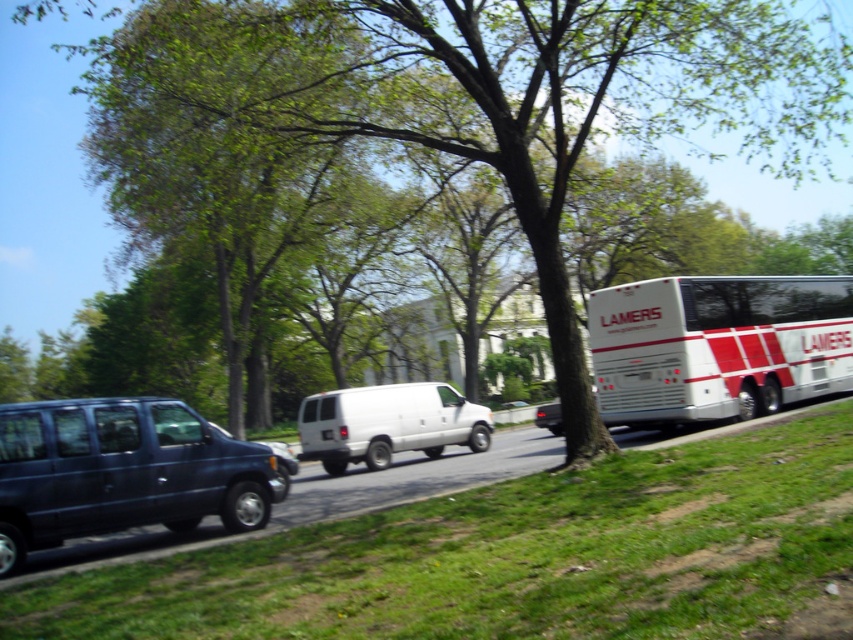
Does green leafy tree at center appear under white/red striped bus at right?

Actually, green leafy tree at center is above white/red striped bus at right.

Does point (375, 310) come behind point (790, 301)?

Yes, point (375, 310) is farther from viewer.

Between point (137, 166) and point (616, 291), which one is positioned in front?

Point (616, 291) is in front.

The height and width of the screenshot is (640, 853). I want to click on green leafy tree at center, so click(x=421, y=166).

Who is higher up, green leafy tree at center or white matte van at center?

green leafy tree at center

Who is positioned more to the right, green leafy tree at center or white matte van at center?

white matte van at center

Where is `green leafy tree at center`? green leafy tree at center is located at coordinates (421, 166).

Is matte black van at left closer to camera compared to white matte van at center?

That is True.

In the scene shown: Does matte black van at left have a smaller size compared to white matte van at center?

Yes, matte black van at left is smaller than white matte van at center.

Is point (33, 426) closer to camera compared to point (299, 419)?

That is True.

Locate an element on the screen. matte black van at left is located at coordinates (120, 472).